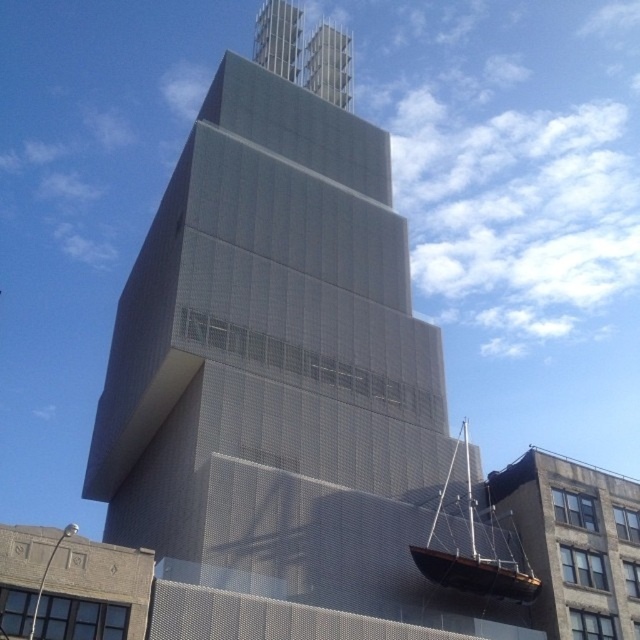
Can you confirm if gray metallic building at center is bigger than wooden sailboat at lower right?

Actually, gray metallic building at center might be smaller than wooden sailboat at lower right.

Who is positioned more to the right, gray metallic building at center or wooden sailboat at lower right?

wooden sailboat at lower right

Which is behind, point (237, 548) or point (509, 570)?

The point (509, 570) is behind.

Image resolution: width=640 pixels, height=640 pixels. Identify the location of gray metallic building at center. tap(291, 392).